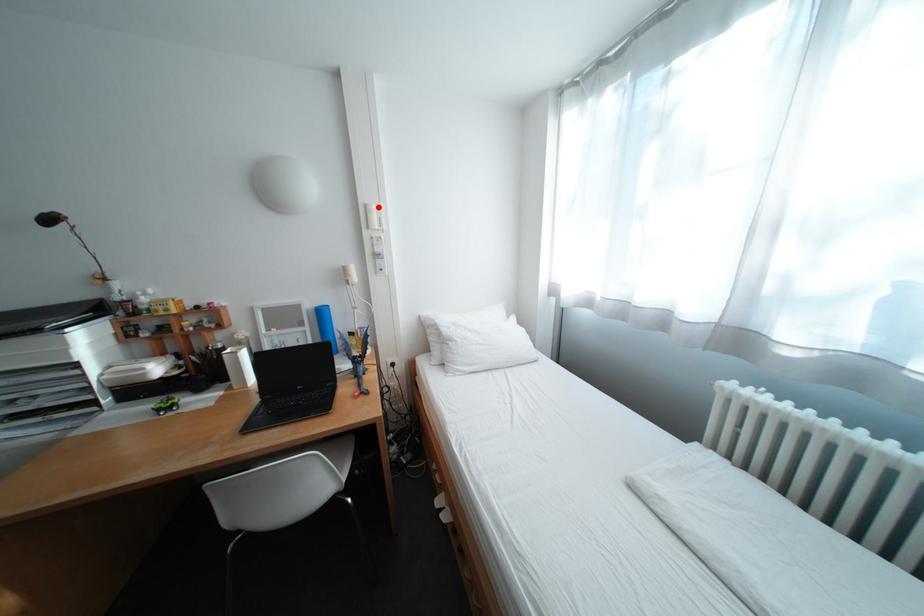
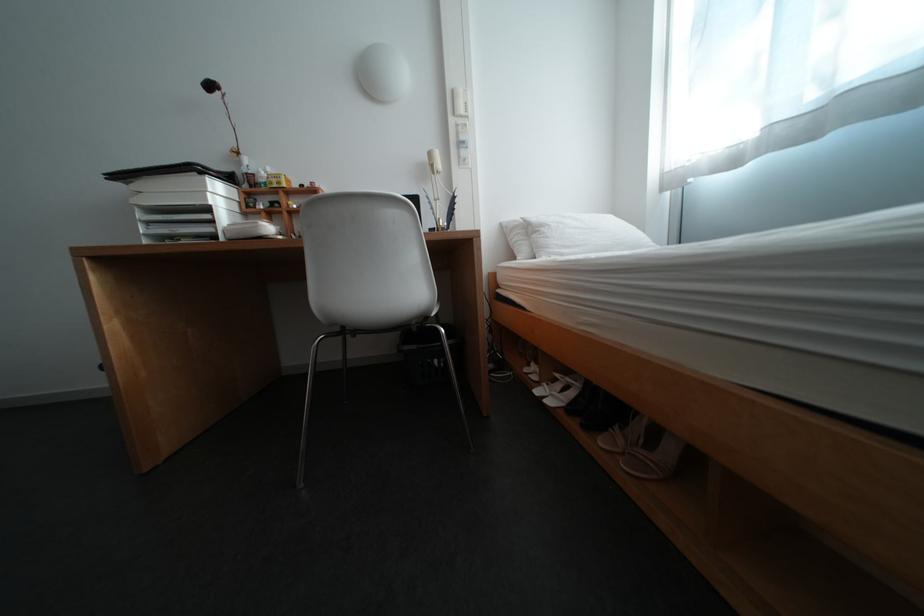
In the second image, find the point that corresponds to the highlighted location in the first image.

(466, 92)